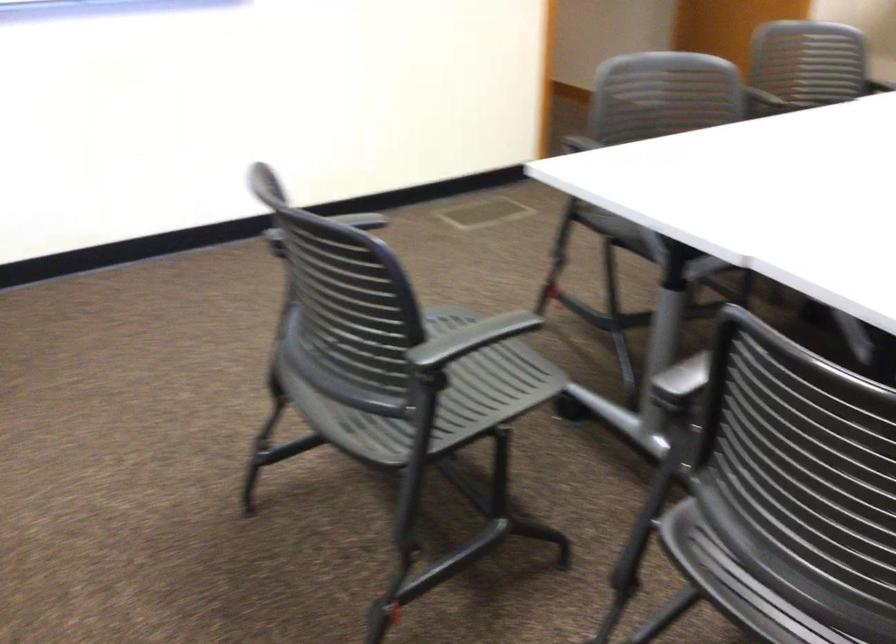
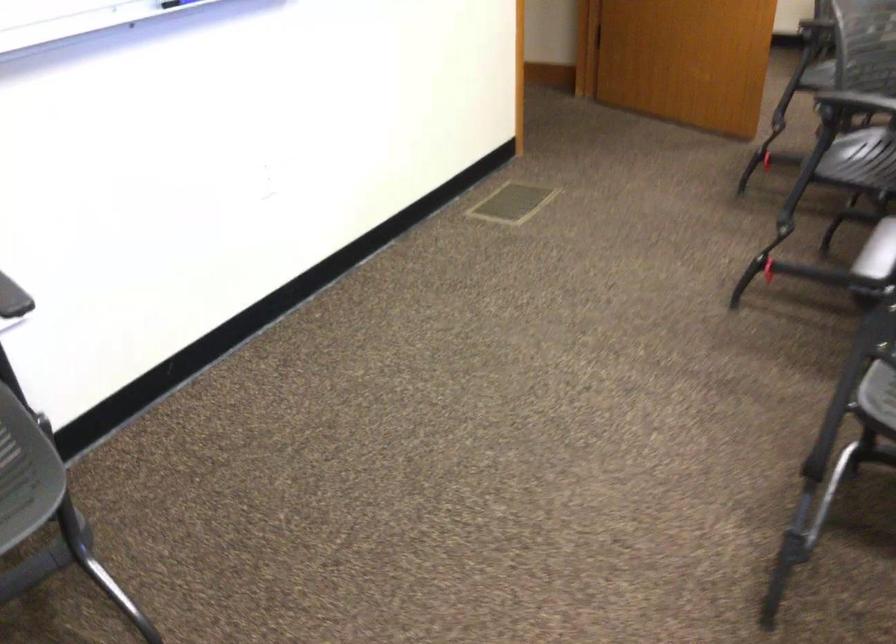
The point at (566,147) is marked in the first image. Where is the corresponding point in the second image?

(857, 102)